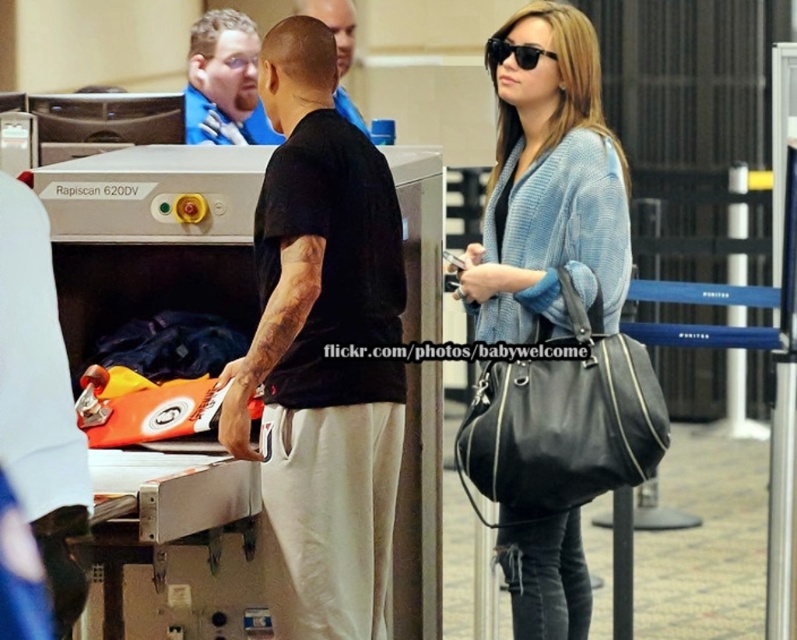
You are a security agent at the airport. You need to check if two passengers are maintaining a safe distance of 6 feet apart. The passengers are wearing the light blue knitted sweater at center and the blue fabric shirt at upper left. Based on the scene, are they maintaining the required distance?

The distance between the light blue knitted sweater at center and the blue fabric shirt at upper left is 11.62 feet, which is greater than the required 6 feet. Therefore, they are maintaining the safe distance.

You are an airport security officer checking the items at the checkpoint. You notice two people at the center of the scene wearing the light blue knitted sweater at center and the shiny blue shirt at center. Which person should you ask to step aside first if you need to clear a path for an emergency cart that requires 3 meters of space?

The light blue knitted sweater at center occupies less space than the shiny blue shirt at center, so you should ask the person wearing the shiny blue shirt at center to step aside first because they take up more space and would require more room to move out of the way.